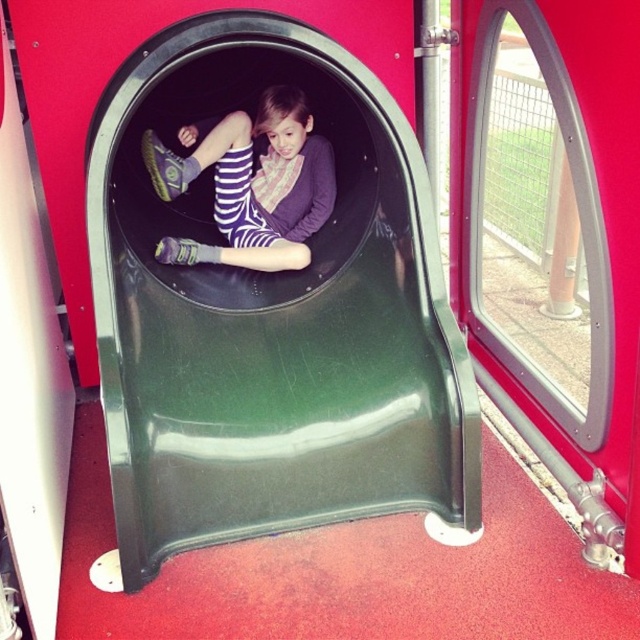
You are a photographer trying to capture a closeup of the child in the slide. You have two markers labeled point A at point (x=140, y=248) and point B at point (x=282, y=100). Which point should you focus on to get the child in focus?

You should focus on point A at point (x=140, y=248) because it is closer to the camera than point B at point (x=282, y=100).

You are a safety inspector checking the playground. The safety guidelines require that the distance between any play equipment and the child should be at least 10 inches to prevent entanglement. Is the green plastic slide at center compliant with this requirement regarding the striped fabric pants at center?

The green plastic slide at center is only 9.84 inches from striped fabric pants at center, which is less than the required 10 inches. Therefore, it does not comply with the safety guidelines to prevent entanglement.

You are a parent trying to locate your child in a playground. You see the green plastic slide at center and the striped fabric pants at center. Based on their positions, where is the child likely sitting?

The green plastic slide at center is located below striped fabric pants at center, so the child is likely sitting on the green plastic slide at center with their striped fabric pants at center visible above them.